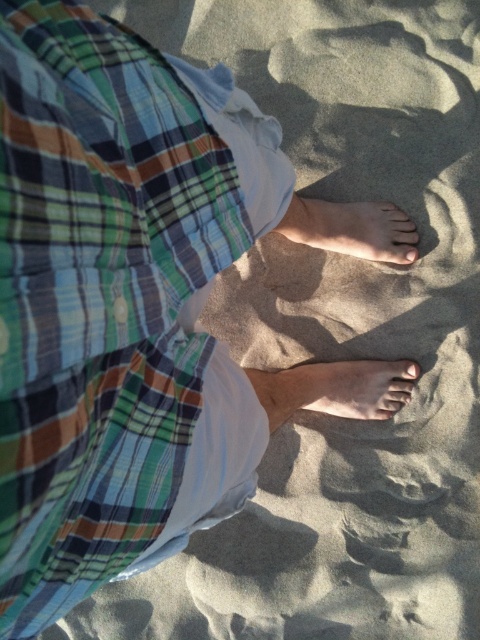
Question: Considering the real-world distances, which object is farthest from the matte skin toe at center?

Choices:
 (A) light brown skin at center
 (B) matte brown toe at center

Answer: (A)

Question: Among these points, which one is farthest from the camera?

Choices:
 (A) (406, 371)
 (B) (408, 248)
 (C) (335, 400)
 (D) (292, 221)

Answer: (B)

Question: Which point appears farthest from the camera in this image?

Choices:
 (A) (400, 220)
 (B) (283, 410)

Answer: (A)

Question: Is light brown skin at center positioned in front of skinny white foot at center?

Choices:
 (A) no
 (B) yes

Answer: (B)

Question: Is skinny white foot at center closer to camera compared to matte brown toe at center?

Choices:
 (A) no
 (B) yes

Answer: (B)

Question: Can you confirm if light brown skin at center is thinner than skinny white foot at center?

Choices:
 (A) no
 (B) yes

Answer: (A)